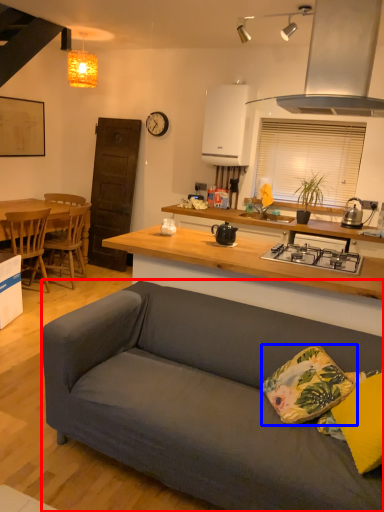
Question: Which point is closer to the camera, studio couch (highlighted by a red box) or pillow (highlighted by a blue box)?

Choices:
 (A) studio couch
 (B) pillow

Answer: (B)